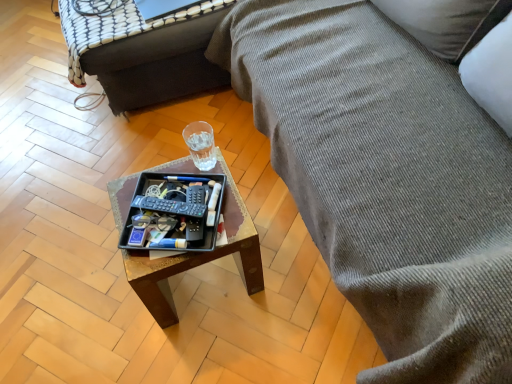
Where is `free space to the left of wooden tray at center`? free space to the left of wooden tray at center is located at coordinates (97, 292).